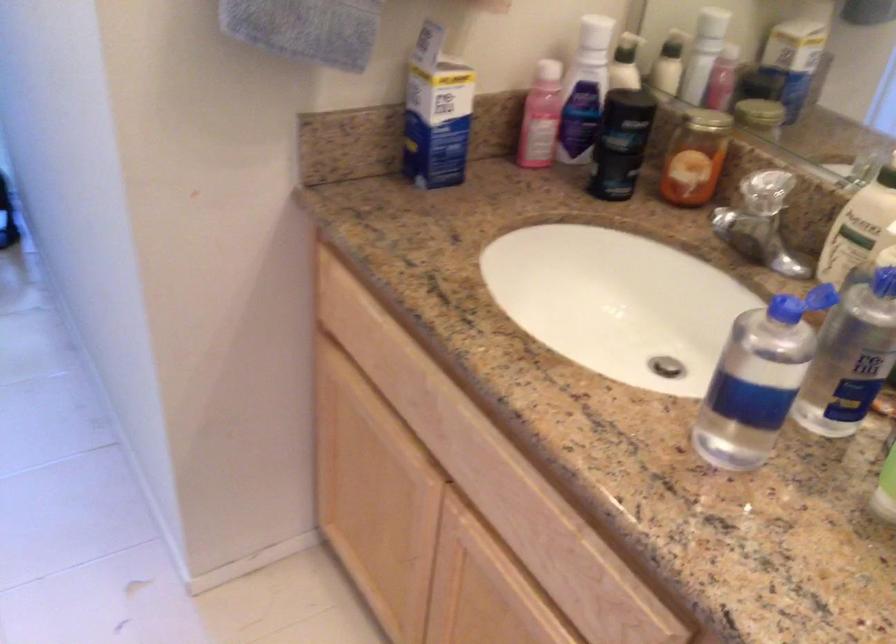
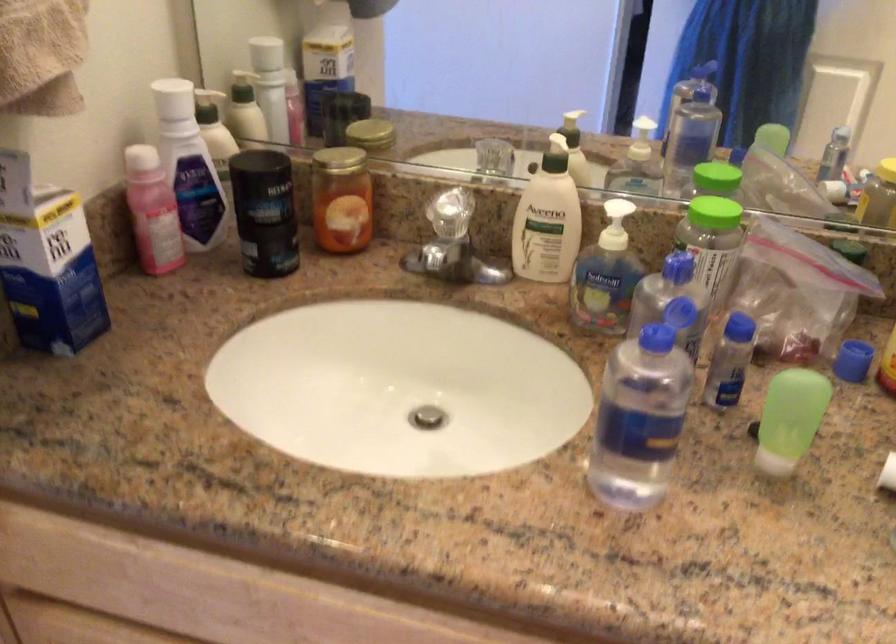
Find the pixel in the second image that matches the point at 426,115 in the first image.

(47, 263)